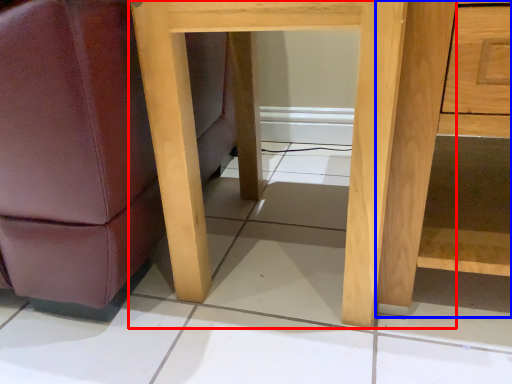
Question: Which object is further to the camera taking this photo, table (highlighted by a red box) or dresser (highlighted by a blue box)?

Choices:
 (A) table
 (B) dresser

Answer: (A)